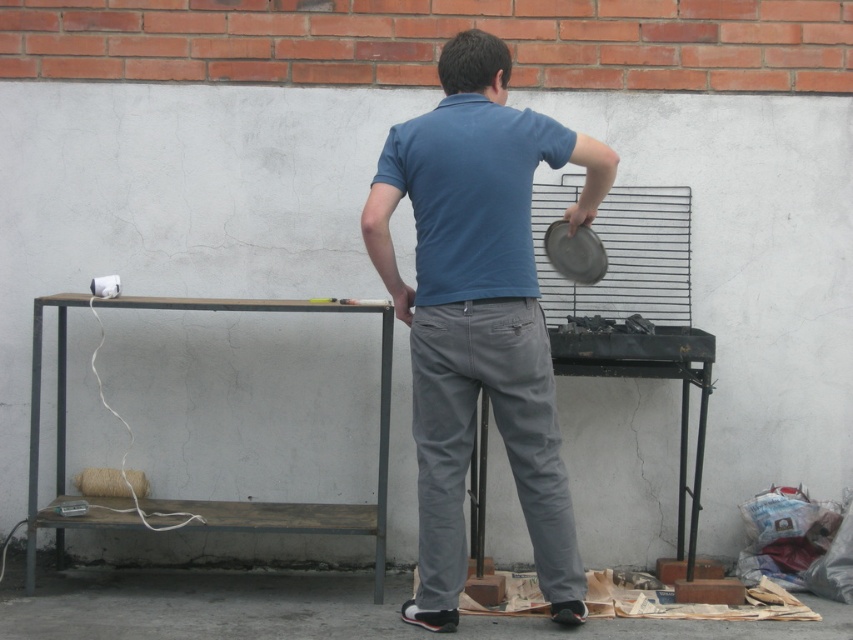
Between point (541, 568) and point (242, 516), which one is positioned in front?

Point (541, 568) is more forward.

Does blue cotton shirt at center appear on the right side of wooden table at lower left?

Correct, you'll find blue cotton shirt at center to the right of wooden table at lower left.

Image resolution: width=853 pixels, height=640 pixels. Find the location of `blue cotton shirt at center`. blue cotton shirt at center is located at coordinates (480, 314).

In order to click on blue cotton shirt at center in this screenshot , I will do `click(480, 314)`.